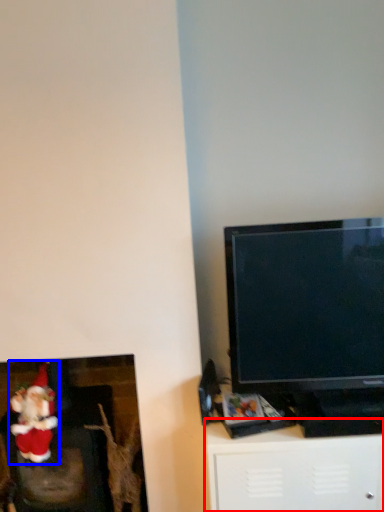
Question: Which object is closer to the camera taking this photo, furniture (highlighted by a red box) or santa claus (highlighted by a blue box)?

Choices:
 (A) furniture
 (B) santa claus

Answer: (A)